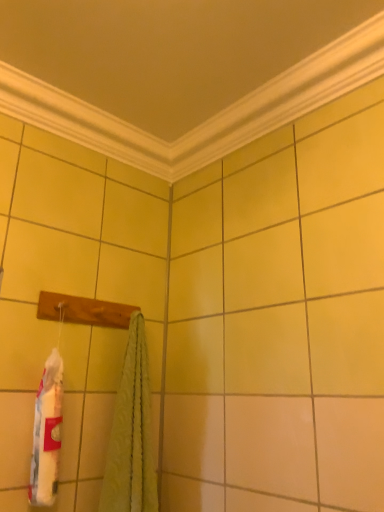
Describe the element at coordinates (84, 310) in the screenshot. The width and height of the screenshot is (384, 512). I see `wooden towel bar at center` at that location.

Where is `wooden towel bar at center`? The width and height of the screenshot is (384, 512). wooden towel bar at center is located at coordinates (84, 310).

Image resolution: width=384 pixels, height=512 pixels. I want to click on wooden towel bar at center, so click(x=84, y=310).